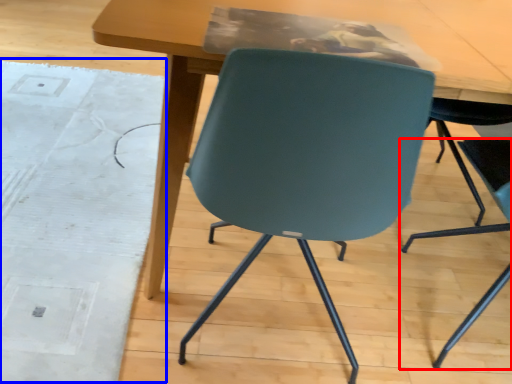
Question: Which point is further to the camera, chair (highlighted by a red box) or mat (highlighted by a blue box)?

Choices:
 (A) chair
 (B) mat

Answer: (B)